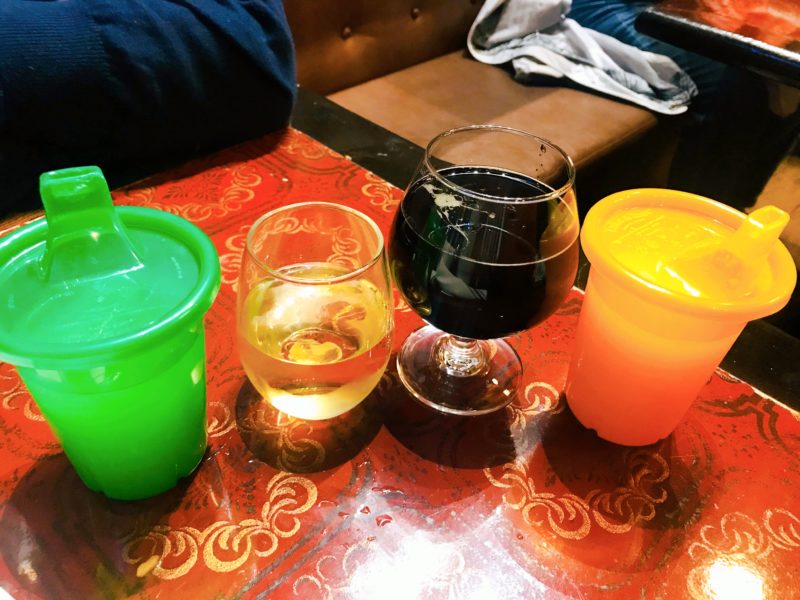
Identify the location of table. Image resolution: width=800 pixels, height=600 pixels. (444, 115).